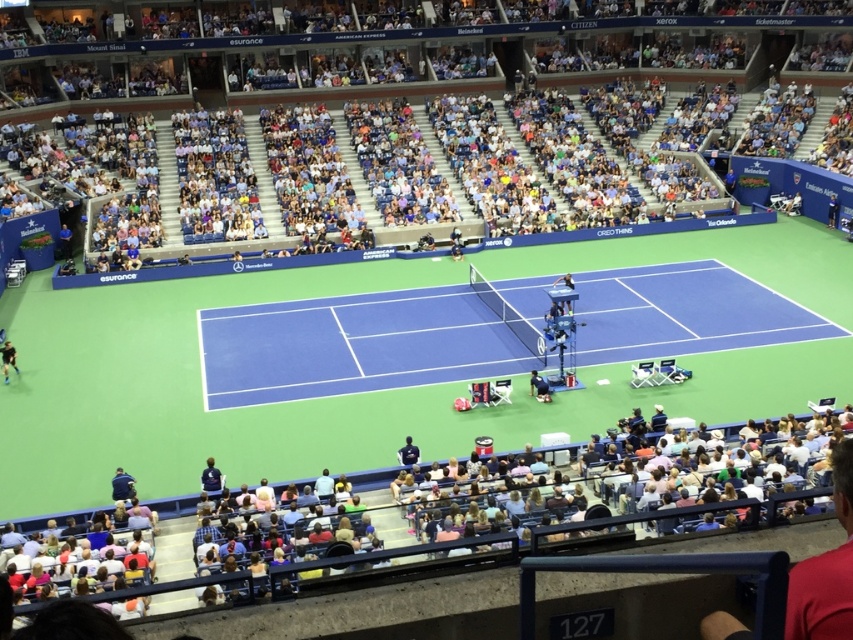
You are a tennis player preparing to sit down after the match. You see the blue fabric seats at upper center and the dark blue fabric chair at center. Which seating option is wider?

The blue fabric seats at upper center might be wider than dark blue fabric chair at center.

You are a photographer standing at the edge of the court and want to capture a photo of the blue synthetic turf tennis court at center and the black fabric person at lower left. Which object appears larger in the photo?

The blue synthetic turf tennis court at center appears larger in the photo because it is taller than the black fabric person at lower left.